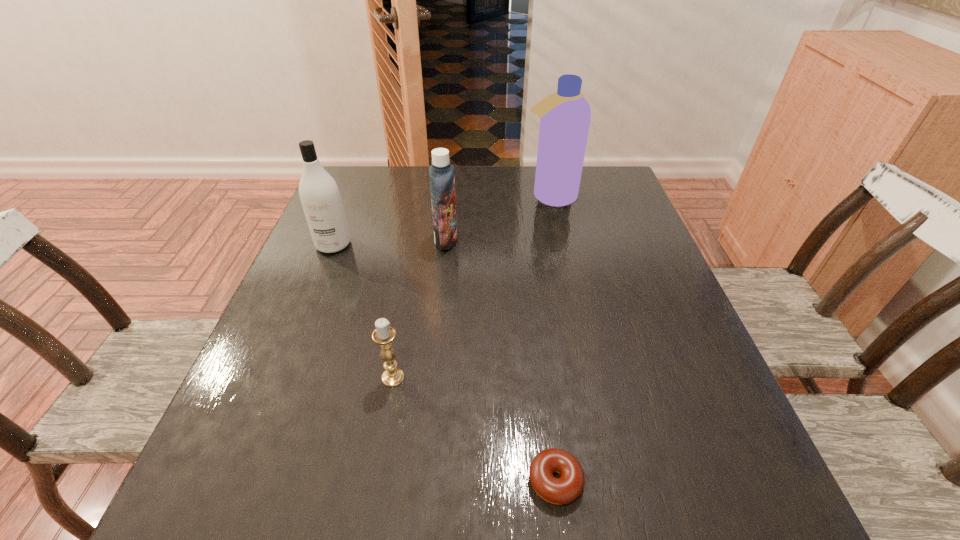
The height and width of the screenshot is (540, 960). What are the coordinates of `free area in between the leftmost shampoo and the shortest object` in the screenshot? It's located at (444, 362).

Locate an element on the screen. This screenshot has width=960, height=540. free space between the third object from right to left and the candle holder is located at coordinates [x=420, y=309].

Select which object appears as the closest to the doughnut. Please provide its 2D coordinates. Your answer should be formatted as a tuple, i.e. [(x, y)], where the tuple contains the x and y coordinates of a point satisfying the conditions above.

[(384, 334)]

This screenshot has height=540, width=960. What are the coordinates of `object that stands as the closest to the leftmost shampoo` in the screenshot? It's located at (441, 173).

Where is `shampoo that is the second closest one to the second shampoo from left to right`? This screenshot has height=540, width=960. shampoo that is the second closest one to the second shampoo from left to right is located at coordinates (319, 194).

Identify which shampoo is located as the second nearest to the nearest object. Please provide its 2D coordinates. Your answer should be formatted as a tuple, i.e. [(x, y)], where the tuple contains the x and y coordinates of a point satisfying the conditions above.

[(319, 194)]

Find the location of a particular element. vacant region that satisfies the following two spatial constraints: 1. on the front-facing side of the second object from left to right; 2. on the left side of the leftmost object is located at coordinates (280, 377).

Where is `vacant region that satisfies the following two spatial constraints: 1. on the front side of the second nearest object; 2. on the right side of the nearest object`? This screenshot has width=960, height=540. vacant region that satisfies the following two spatial constraints: 1. on the front side of the second nearest object; 2. on the right side of the nearest object is located at coordinates (375, 481).

You are a GUI agent. You are given a task and a screenshot of the screen. Output one action in this format:
    pyautogui.click(x=<x>, y=<y>)
    Task: Click on the free space that satisfies the following two spatial constraints: 1. on the front-facing side of the candle holder; 2. on the right side of the leftmost object
    The image size is (960, 540).
    Given the screenshot: What is the action you would take?
    pyautogui.click(x=280, y=377)

This screenshot has height=540, width=960. Identify the location of vacant point that satisfies the following two spatial constraints: 1. on the front label of the third object from right to left; 2. on the back side of the shortest object. (423, 481).